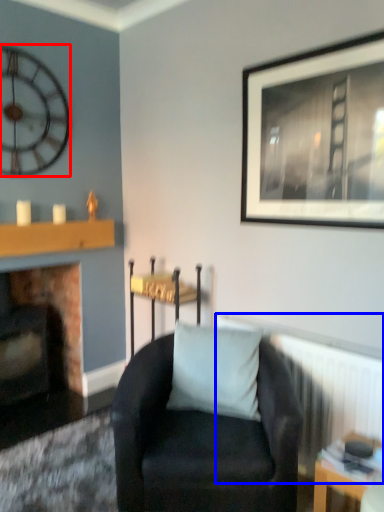
Question: Among these objects, which one is nearest to the camera, wall clock (highlighted by a red box) or radiator (highlighted by a blue box)?

Choices:
 (A) wall clock
 (B) radiator

Answer: (B)